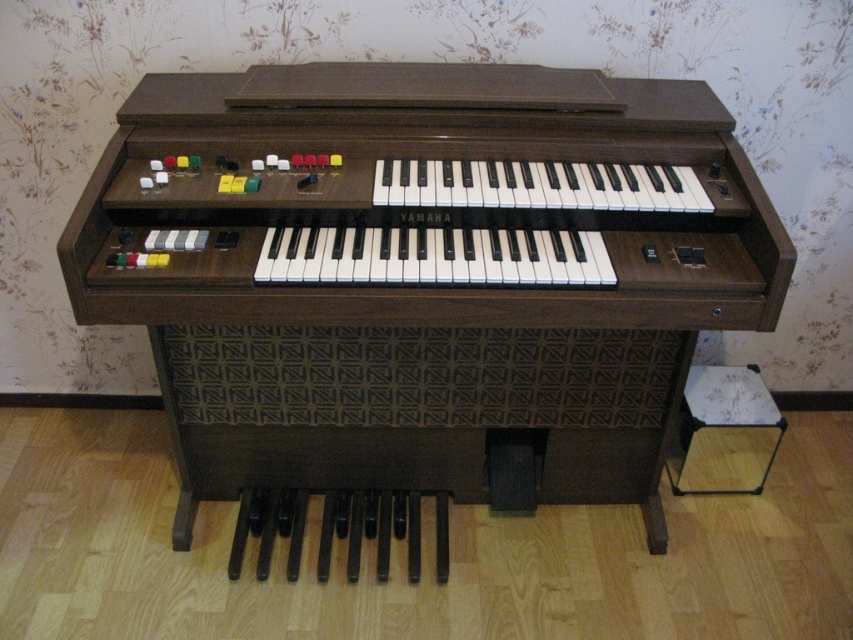
You are an interior designer planning to place a new sofa in the living room where the wooden piano at center is located. The room has a coordinate system where the bottom left corner is the origin. If the sofa will be placed at coordinates point A at point A at point A at point A at point A at point A at point A at point A at point A at point A at point A at point A at point A at point A at point A at point A at point A at point A at point A at point A at point A at point A at point A at point A at point A

The wooden piano at center is located at coordinates point A at point A at point A at point A at point A at point A at point A at point A at point A at point A at point A at point A at point A at point A at point A at point A at point A at point point A at point A at point A at point A at point A at point A at point A at point A at point A at point A at point A at point A at point A at point A at point A at point A at point A at point A at point A at point A at point A at point A at point A at point A at 0.

You are a musician who needs to sit on the stool to play the piano. Given the sizes of the wooden piano at center and the white glossy stool at lower right, will the stool be a suitable size for you to comfortably reach the piano keys?

The wooden piano at center is bigger than the white glossy stool at lower right, so the stool is smaller and likely a suitable size for reaching the piano keys comfortably.

You are a musician who needs to sit on the white glossy stool at lower right to play the wooden piano at center. Can you reach the piano keys comfortably from the stool?

The wooden piano at center is 31.17 inches away from the white glossy stool at lower right. This distance is within a comfortable range for most people to reach the piano keys comfortably.